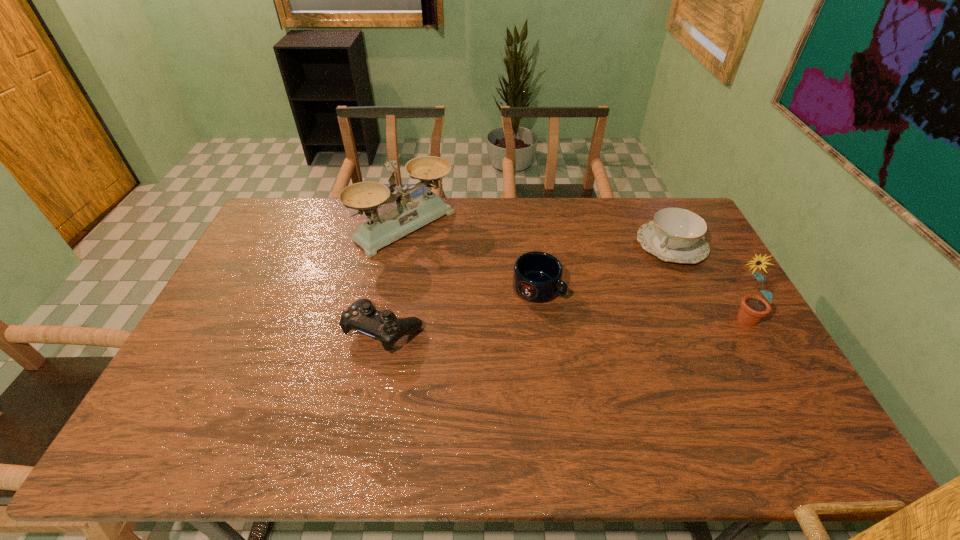
Where is `vacant region between the sunflower and the scale`? This screenshot has height=540, width=960. vacant region between the sunflower and the scale is located at coordinates (572, 273).

You are a GUI agent. You are given a task and a screenshot of the screen. Output one action in this format:
    pyautogui.click(x=<x>, y=<y>)
    Task: Click on the free space between the scale and the third object from right to left
    The width and height of the screenshot is (960, 540).
    Given the screenshot: What is the action you would take?
    pyautogui.click(x=471, y=256)

Identify the location of object that stands as the second closest to the scale. (362, 316).

Locate an element on the screen. This screenshot has width=960, height=540. the fourth closest object relative to the chinaware is located at coordinates (362, 316).

This screenshot has height=540, width=960. What are the coordinates of `vacant region that satisfies the following two spatial constraints: 1. on the front side of the scale; 2. on the left side of the chinaware` in the screenshot? It's located at (401, 245).

At what (x,y) coordinates should I click in order to perform the action: click on free space that satisfies the following two spatial constraints: 1. on the back side of the scale; 2. on the left side of the control. Please return your answer as a coordinate pair (x, y). The height and width of the screenshot is (540, 960). Looking at the image, I should click on (405, 226).

What are the coordinates of `free space that satisfies the following two spatial constraints: 1. on the back side of the mug; 2. on the right side of the control` in the screenshot? It's located at (393, 287).

Find the location of a particular element. This screenshot has height=540, width=960. vacant position in the image that satisfies the following two spatial constraints: 1. on the front side of the third object from right to left; 2. on the flower of the sunflower is located at coordinates (541, 320).

Find the location of a particular element. This screenshot has height=540, width=960. free space that satisfies the following two spatial constraints: 1. on the front side of the scale; 2. on the flower of the sunflower is located at coordinates (387, 320).